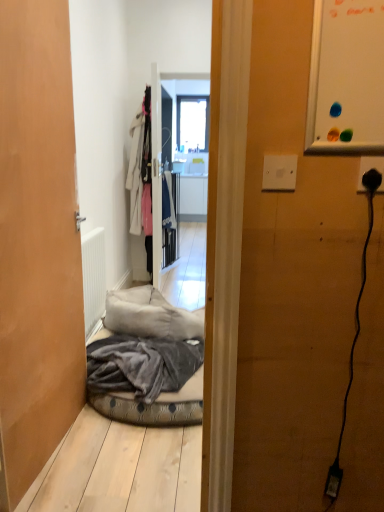
Question: From the image's perspective, does white fabric coat at center appear higher than transparent glass window at center?

Choices:
 (A) yes
 (B) no

Answer: (B)

Question: Does white fabric coat at center have a smaller size compared to transparent glass window at center?

Choices:
 (A) no
 (B) yes

Answer: (A)

Question: Is transparent glass window at center completely or partially inside white fabric coat at center?

Choices:
 (A) no
 (B) yes

Answer: (A)

Question: Is white fabric coat at center next to transparent glass window at center?

Choices:
 (A) yes
 (B) no

Answer: (B)

Question: Can you confirm if white fabric coat at center is taller than transparent glass window at center?

Choices:
 (A) yes
 (B) no

Answer: (A)

Question: Is transparent glass window at center in front of or behind wooden door at left in the image?

Choices:
 (A) behind
 (B) front

Answer: (A)

Question: From the image's perspective, is transparent glass window at center positioned above or below wooden door at left?

Choices:
 (A) below
 (B) above

Answer: (B)

Question: Would you say transparent glass window at center is inside or outside wooden door at left?

Choices:
 (A) outside
 (B) inside

Answer: (A)

Question: Would you say transparent glass window at center is to the left or to the right of wooden door at left in the picture?

Choices:
 (A) right
 (B) left

Answer: (A)

Question: Is transparent glass window at center wider or thinner than black plastic plug at right?

Choices:
 (A) thin
 (B) wide

Answer: (B)

Question: From a real-world perspective, is transparent glass window at center positioned above or below black plastic plug at right?

Choices:
 (A) below
 (B) above

Answer: (B)

Question: Relative to black plastic plug at right, is transparent glass window at center in front or behind?

Choices:
 (A) front
 (B) behind

Answer: (B)

Question: From their relative heights in the image, would you say transparent glass window at center is taller or shorter than black plastic plug at right?

Choices:
 (A) short
 (B) tall

Answer: (B)

Question: Looking at the image, does wooden door at left seem bigger or smaller compared to transparent glass window at center?

Choices:
 (A) small
 (B) big

Answer: (A)

Question: Looking at their shapes, would you say wooden door at left is wider or thinner than transparent glass window at center?

Choices:
 (A) thin
 (B) wide

Answer: (A)